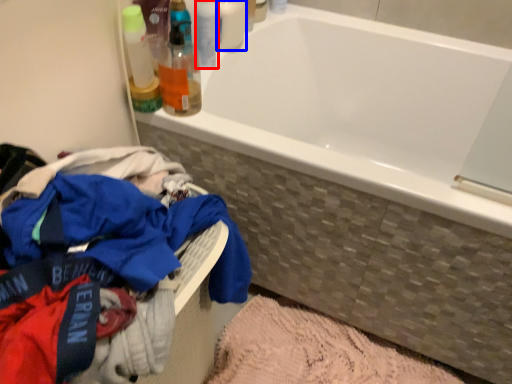
Question: Which object appears farthest to the camera in this image, toiletry (highlighted by a red box) or toiletry (highlighted by a blue box)?

Choices:
 (A) toiletry
 (B) toiletry

Answer: (A)